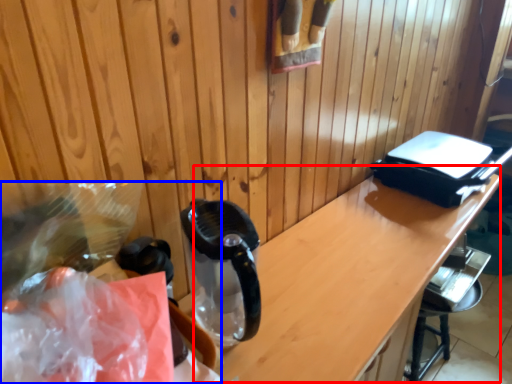
Question: Which object is closer to the camera taking this photo, table (highlighted by a red box) or waste (highlighted by a blue box)?

Choices:
 (A) table
 (B) waste

Answer: (B)